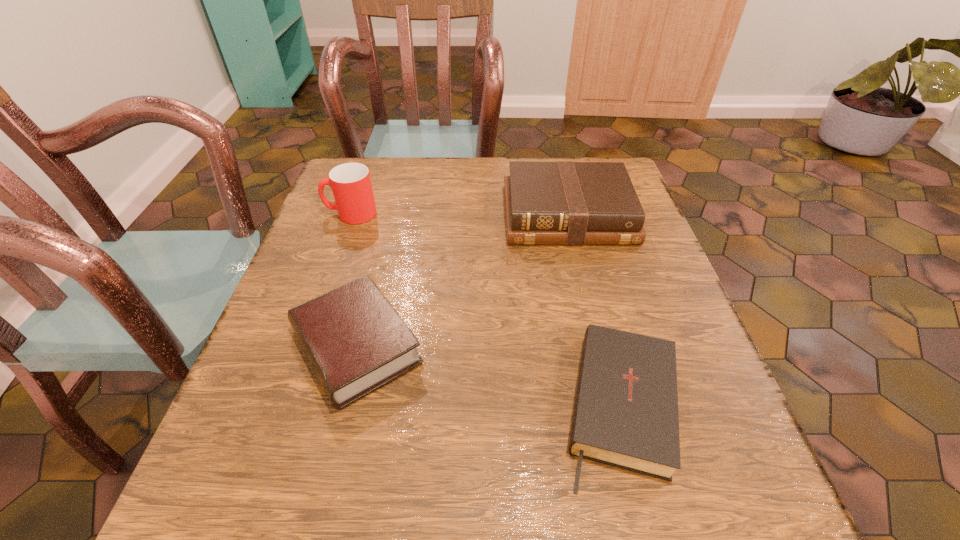
In the image, there is a desktop. Where is `blank space at the right edge`? blank space at the right edge is located at coordinates tap(661, 335).

Locate an element on the screen. blank area at the far left corner is located at coordinates (382, 176).

Find the location of a particular element. The width and height of the screenshot is (960, 540). free space at the near left corner is located at coordinates (191, 523).

The height and width of the screenshot is (540, 960). I want to click on vacant space at the near right corner, so click(657, 516).

At what (x,y) coordinates should I click in order to perform the action: click on free space between the second shortest Bible and the cup. Please return your answer as a coordinate pair (x, y). This screenshot has width=960, height=540. Looking at the image, I should click on (353, 280).

Find the location of a particular element. The height and width of the screenshot is (540, 960). unoccupied position between the cup and the third shortest object is located at coordinates (459, 214).

Where is `vacant space in between the shortest object and the tallest object`? vacant space in between the shortest object and the tallest object is located at coordinates pyautogui.click(x=487, y=310).

Find the location of `free space between the shortest object and the leftmost Bible`. free space between the shortest object and the leftmost Bible is located at coordinates (490, 376).

Where is `free point between the shortest object and the tallest object`? This screenshot has height=540, width=960. free point between the shortest object and the tallest object is located at coordinates (487, 310).

At what (x,y) coordinates should I click in order to perform the action: click on vacant region between the tallest object and the second shortest object. Please return your answer as a coordinate pair (x, y). The image size is (960, 540). Looking at the image, I should click on tap(353, 280).